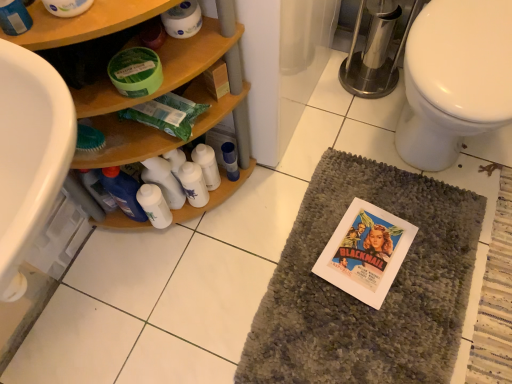
At what (x,y) coordinates should I click in order to perform the action: click on vacant space to the left of white glossy toilet at right. Please return your answer as a coordinate pair (x, y). Looking at the image, I should click on (319, 175).